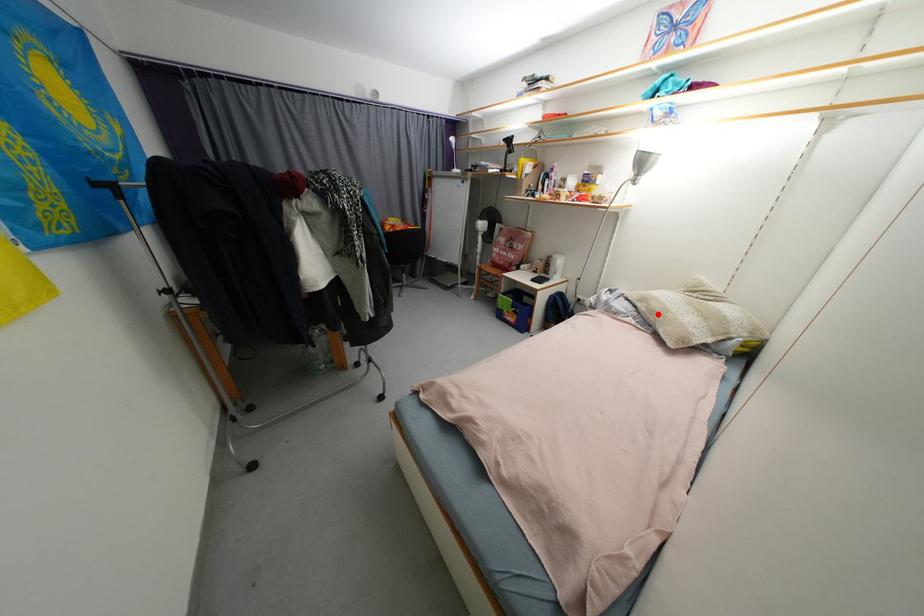
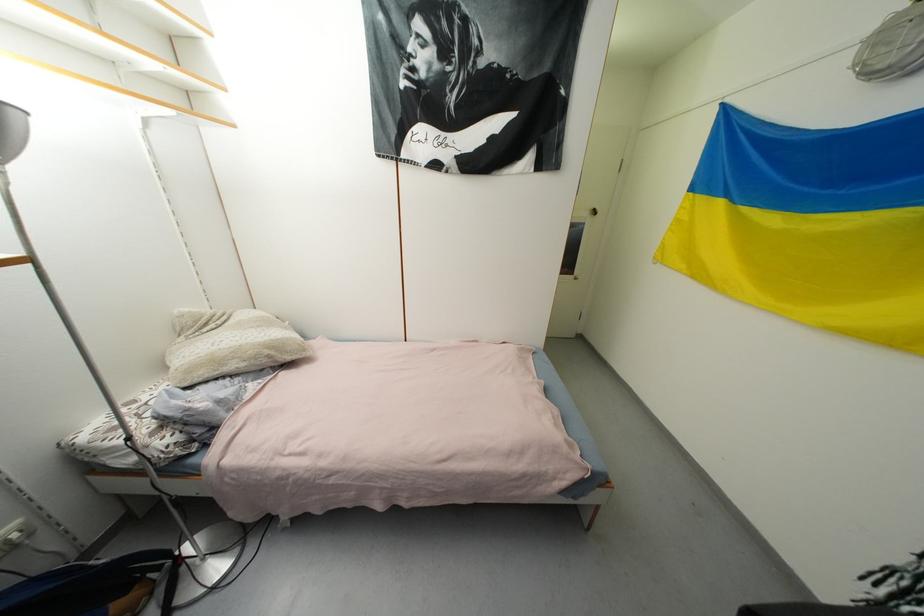
Find the pixel in the second image that matches the highlighted location in the first image.

(261, 359)